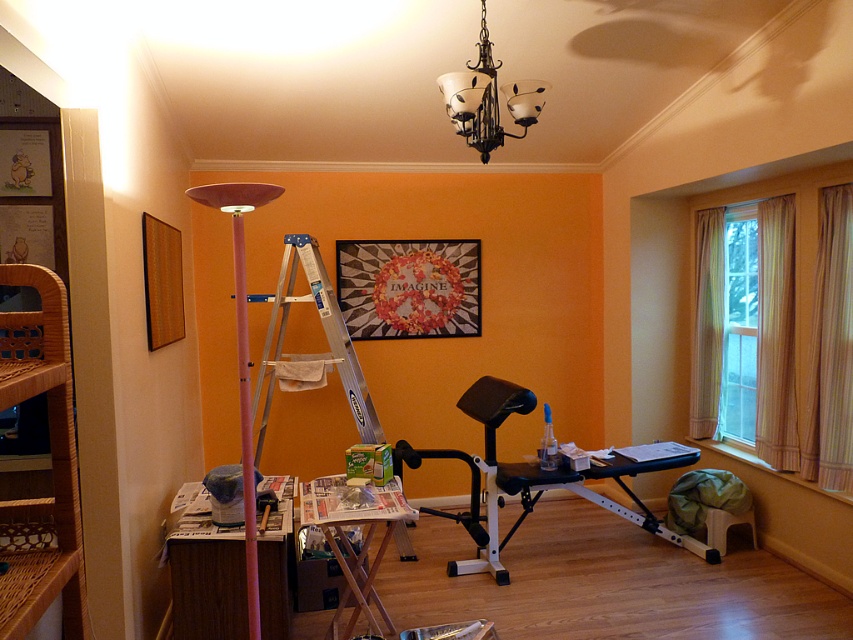
Question: Which object is closer to the camera taking this photo?

Choices:
 (A) silver/aluminum ladder at center
 (B) black plastic bench at center
 (C) wooden table at lower left

Answer: (C)

Question: From the image, what is the correct spatial relationship of wooden table at lower left in relation to black plastic bench at center?

Choices:
 (A) above
 (B) below

Answer: (A)

Question: Which object appears closest to the camera in this image?

Choices:
 (A) woven wood bookshelf at left
 (B) wooden picture frame at left

Answer: (A)

Question: Can you confirm if wooden folding table at center is positioned below black plastic bench at center?

Choices:
 (A) no
 (B) yes

Answer: (B)

Question: Observing the image, what is the correct spatial positioning of wooden table at lower left in reference to clear glass window at center?

Choices:
 (A) above
 (B) below

Answer: (B)

Question: Which of the following is the farthest from the observer?

Choices:
 (A) silver/aluminum ladder at center
 (B) clear glass window at right

Answer: (A)